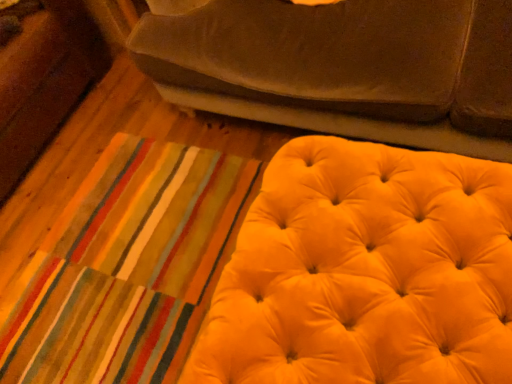
The width and height of the screenshot is (512, 384). What do you see at coordinates (366, 272) in the screenshot?
I see `yellow velvet ottoman at lower right` at bounding box center [366, 272].

The height and width of the screenshot is (384, 512). Find the location of `yellow velvet ottoman at lower right`. yellow velvet ottoman at lower right is located at coordinates (366, 272).

The width and height of the screenshot is (512, 384). Identify the location of suede-like brown studio couch at upper center. click(342, 67).

Describe the element at coordinates (342, 67) in the screenshot. I see `suede-like brown studio couch at upper center` at that location.

Locate an element on the screen. Image resolution: width=512 pixels, height=384 pixels. yellow velvet ottoman at lower right is located at coordinates (366, 272).

Between suede-like brown studio couch at upper center and yellow velvet ottoman at lower right, which one appears on the left side from the viewer's perspective?

From the viewer's perspective, yellow velvet ottoman at lower right appears more on the left side.

Which is in front, suede-like brown studio couch at upper center or yellow velvet ottoman at lower right?

yellow velvet ottoman at lower right is in front.

Is point (344, 69) positioned after point (362, 193)?

Yes.

From the image's perspective, would you say suede-like brown studio couch at upper center is shown under yellow velvet ottoman at lower right?

Incorrect, from the image's perspective, suede-like brown studio couch at upper center is higher than yellow velvet ottoman at lower right.

From a real-world perspective, is suede-like brown studio couch at upper center positioned under yellow velvet ottoman at lower right based on gravity?

No, from a real-world perspective, suede-like brown studio couch at upper center is not beneath yellow velvet ottoman at lower right.

Which object is thinner, suede-like brown studio couch at upper center or yellow velvet ottoman at lower right?

With smaller width is yellow velvet ottoman at lower right.

Can you confirm if suede-like brown studio couch at upper center is taller than yellow velvet ottoman at lower right?

Indeed, suede-like brown studio couch at upper center has a greater height compared to yellow velvet ottoman at lower right.

Between suede-like brown studio couch at upper center and yellow velvet ottoman at lower right, which one has larger size?

With larger size is suede-like brown studio couch at upper center.

Would you say suede-like brown studio couch at upper center is inside or outside yellow velvet ottoman at lower right?

suede-like brown studio couch at upper center is spatially situated outside yellow velvet ottoman at lower right.

Would you say suede-like brown studio couch at upper center is a long distance from yellow velvet ottoman at lower right?

No, suede-like brown studio couch at upper center is not far away from yellow velvet ottoman at lower right.

Could you tell me if suede-like brown studio couch at upper center is facing yellow velvet ottoman at lower right?

Yes.

Measure the distance from suede-like brown studio couch at upper center to yellow velvet ottoman at lower right.

suede-like brown studio couch at upper center and yellow velvet ottoman at lower right are 14.83 inches apart from each other.

In the image, there is a suede-like brown studio couch at upper center. Identify the location of furniture below it (from a real-world perspective). The image size is (512, 384). (366, 272).

Considering the relative positions of yellow velvet ottoman at lower right and suede-like brown studio couch at upper center in the image provided, is yellow velvet ottoman at lower right to the left of suede-like brown studio couch at upper center from the viewer's perspective?

Yes, yellow velvet ottoman at lower right is to the left of suede-like brown studio couch at upper center.

Which object is closer to the camera taking this photo, yellow velvet ottoman at lower right or suede-like brown studio couch at upper center?

Positioned in front is yellow velvet ottoman at lower right.

Between point (493, 304) and point (343, 123), which one is positioned in front?

Point (493, 304)

From the image's perspective, relative to suede-like brown studio couch at upper center, is yellow velvet ottoman at lower right above or below?

From the image's perspective, yellow velvet ottoman at lower right appears below suede-like brown studio couch at upper center.

From a real-world perspective, is yellow velvet ottoman at lower right positioned over suede-like brown studio couch at upper center based on gravity?

No.

Can you confirm if yellow velvet ottoman at lower right is wider than suede-like brown studio couch at upper center?

Incorrect, the width of yellow velvet ottoman at lower right does not surpass that of suede-like brown studio couch at upper center.

In terms of height, does yellow velvet ottoman at lower right look taller or shorter compared to suede-like brown studio couch at upper center?

Clearly, yellow velvet ottoman at lower right is shorter compared to suede-like brown studio couch at upper center.

Is yellow velvet ottoman at lower right bigger than suede-like brown studio couch at upper center?

No.

Consider the image. Would you say yellow velvet ottoman at lower right is outside suede-like brown studio couch at upper center?

Yes.

Is yellow velvet ottoman at lower right far away from suede-like brown studio couch at upper center?

They are positioned close to each other.

Looking at this image, is yellow velvet ottoman at lower right oriented away from suede-like brown studio couch at upper center?

No, yellow velvet ottoman at lower right is not facing away from suede-like brown studio couch at upper center.

Can you tell me how much yellow velvet ottoman at lower right and suede-like brown studio couch at upper center differ in facing direction?

The angular difference between yellow velvet ottoman at lower right and suede-like brown studio couch at upper center is 91.9 degrees.

Locate an element on the screen. furniture in front of the suede-like brown studio couch at upper center is located at coordinates pos(366,272).

Where is `furniture beneath the suede-like brown studio couch at upper center (from a real-world perspective)`? The image size is (512, 384). furniture beneath the suede-like brown studio couch at upper center (from a real-world perspective) is located at coordinates (366, 272).

You are a GUI agent. You are given a task and a screenshot of the screen. Output one action in this format:
    pyautogui.click(x=<x>, y=<y>)
    Task: Click on the studio couch behind the yellow velvet ottoman at lower right
    This screenshot has width=512, height=384.
    Given the screenshot: What is the action you would take?
    pyautogui.click(x=342, y=67)